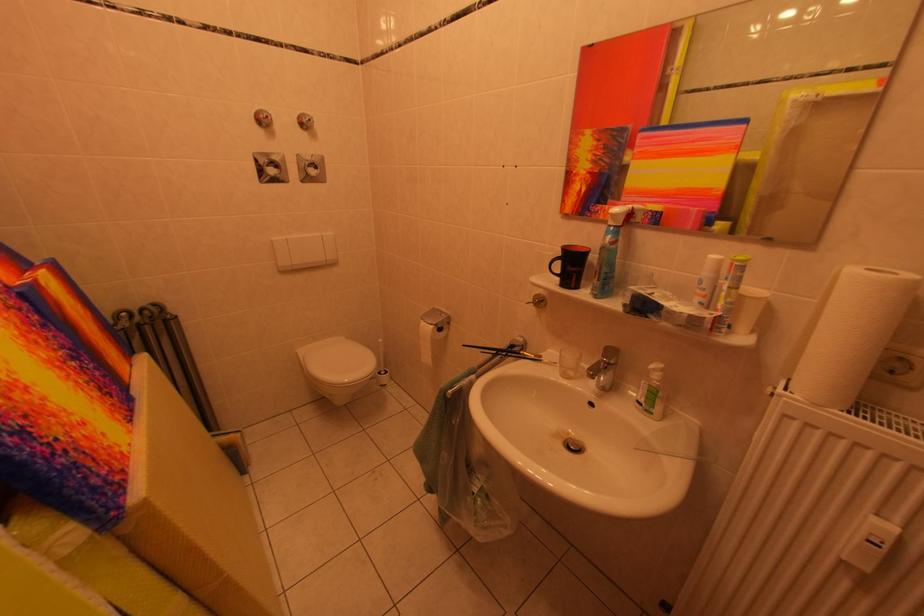
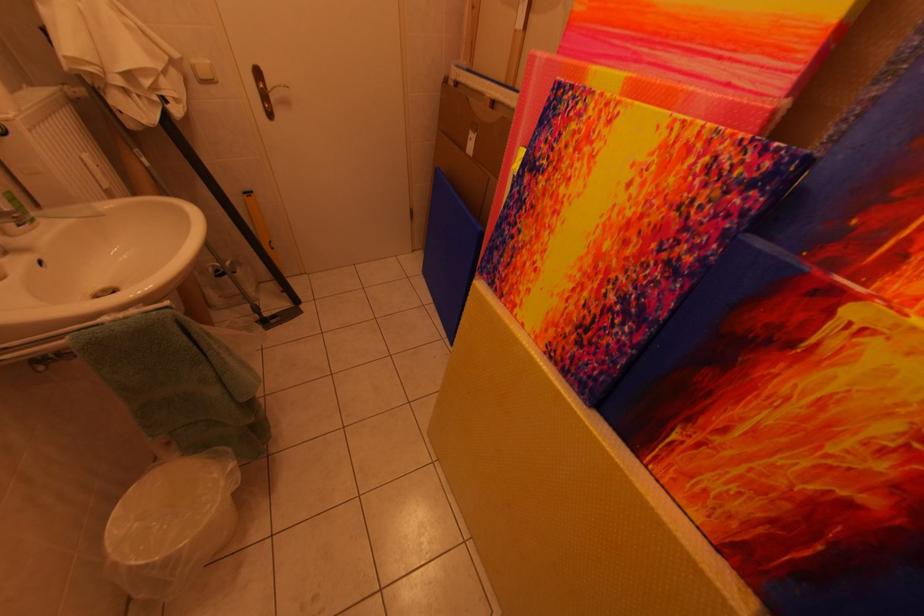
In the second image, find the point that corresponds to pixel 53 286 in the first image.

(861, 317)